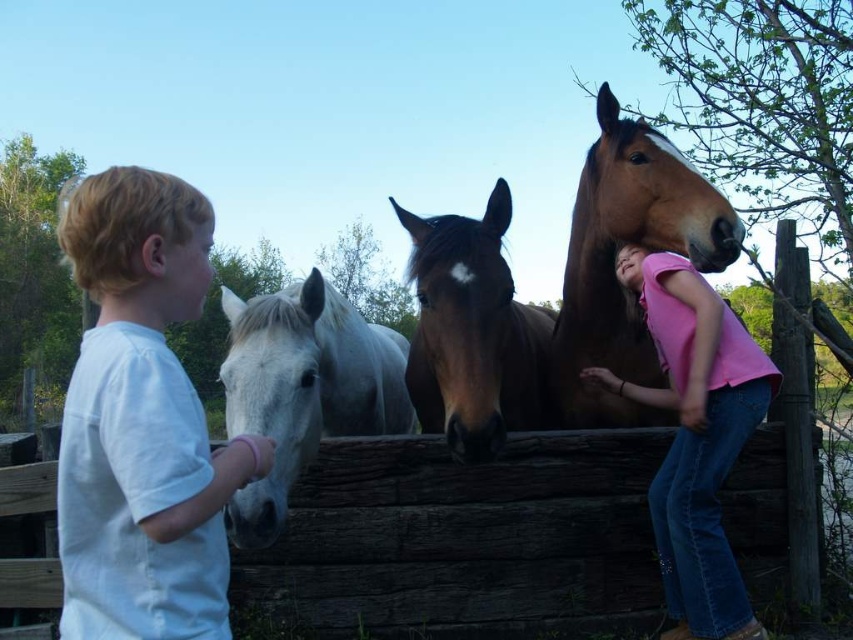
Question: Is white glossy horse at center to the right of brown glossy horse at center from the viewer's perspective?

Choices:
 (A) no
 (B) yes

Answer: (A)

Question: Which object appears farthest from the camera in this image?

Choices:
 (A) white glossy horse at center
 (B) brown glossy horse at upper right
 (C) white cotton shirt at left

Answer: (B)

Question: Which point is farther to the camera?

Choices:
 (A) (177, 608)
 (B) (654, 324)
 (C) (305, 278)

Answer: (B)

Question: Is white cotton shirt at left above white glossy horse at center?

Choices:
 (A) yes
 (B) no

Answer: (A)

Question: Can you confirm if brown glossy horse at upper right is positioned below brown glossy horse at center?

Choices:
 (A) yes
 (B) no

Answer: (B)

Question: Which object is farther from the camera taking this photo?

Choices:
 (A) brown glossy horse at upper right
 (B) white cotton shirt at left

Answer: (A)